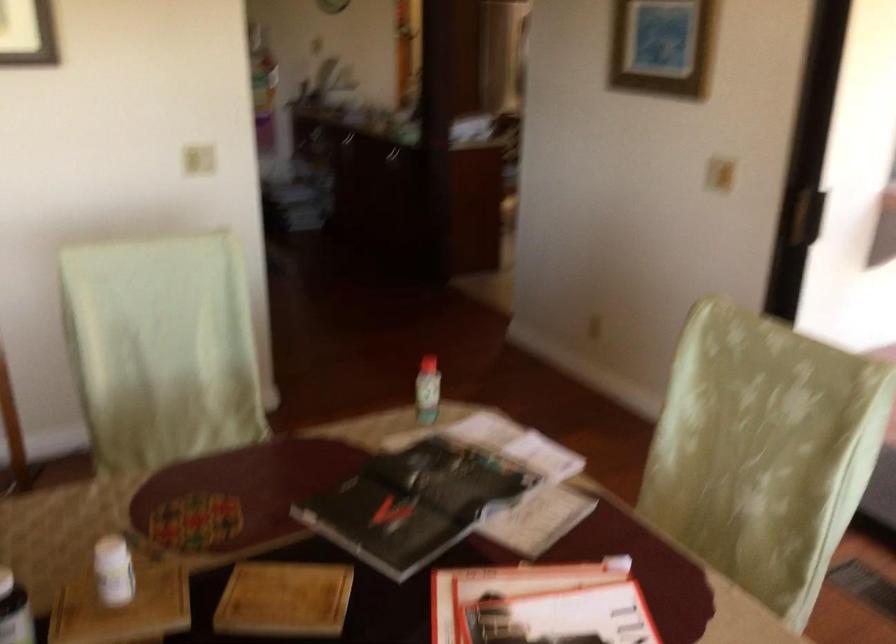
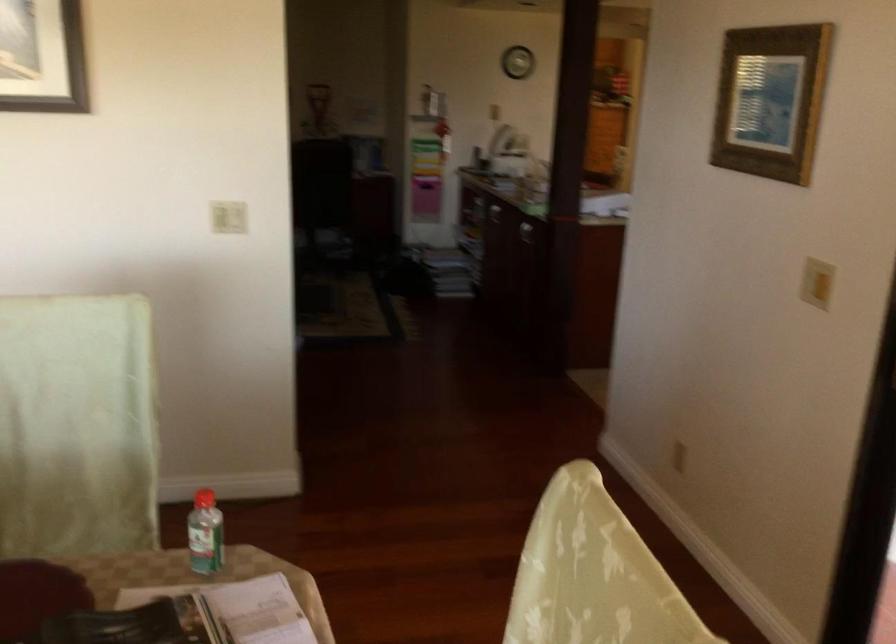
The point at [428,389] is marked in the first image. Where is the corresponding point in the second image?

(204, 534)